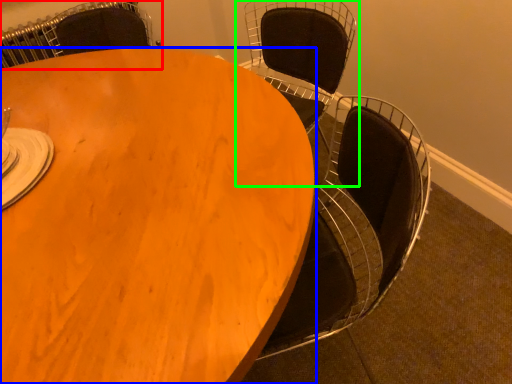
Question: Estimate the real-world distances between objects in this image. Which object is closer to chair (highlighted by a red box), table (highlighted by a blue box) or chair (highlighted by a green box)?

Choices:
 (A) table
 (B) chair

Answer: (B)